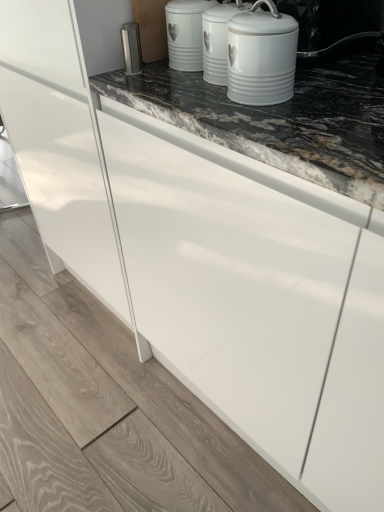
Question: Considering the positions of white ceramic canister at upper center and satin silver canister at upper center in the image, is white ceramic canister at upper center wider or thinner than satin silver canister at upper center?

Choices:
 (A) wide
 (B) thin

Answer: (A)

Question: From a real-world perspective, is white ceramic canister at upper center physically located above or below satin silver canister at upper center?

Choices:
 (A) below
 (B) above

Answer: (B)

Question: Which object is positioned farthest from the white ceramic canister at upper center?

Choices:
 (A) white ceramic canister at upper center
 (B) satin silver canister at upper center

Answer: (A)

Question: Which object is the farthest from the satin silver canister at upper center?

Choices:
 (A) white ceramic canister at upper center
 (B) white ceramic canister at upper center

Answer: (B)